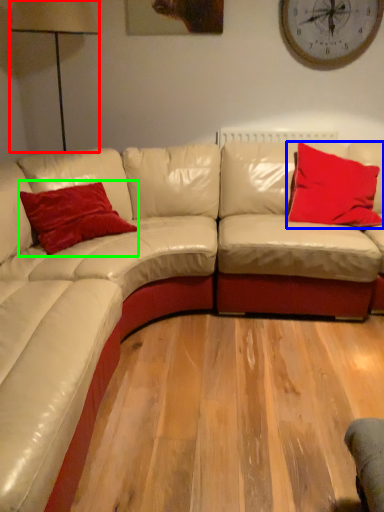
Question: Which object is the closest to the table lamp (highlighted by a red box)? Choose among these: pillow (highlighted by a blue box) or pillow (highlighted by a green box).

Choices:
 (A) pillow
 (B) pillow

Answer: (B)